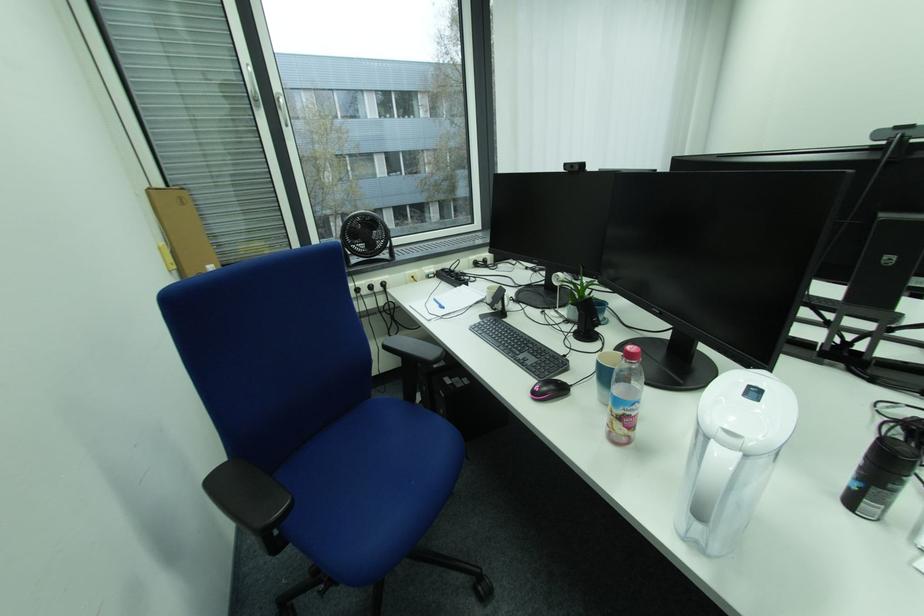
Which object does [549,390] point to?

This point indicates the pink computer mouse.